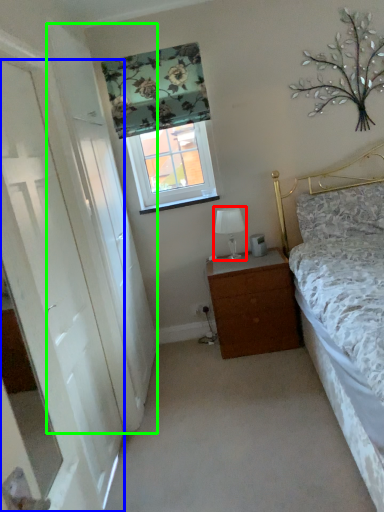
Question: Which object is the farthest from table lamp (highlighted by a red box)? Choose among these: door (highlighted by a blue box) or screen door (highlighted by a green box).

Choices:
 (A) door
 (B) screen door

Answer: (A)